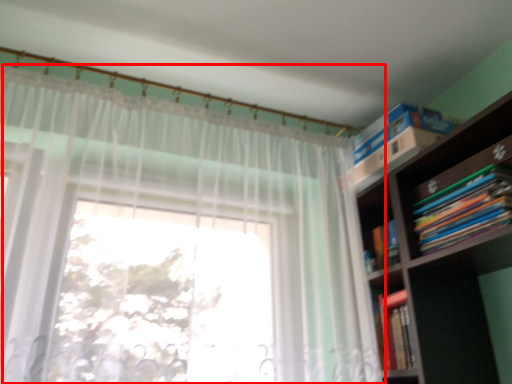
Question: Where is curtain (annotated by the red box) located in relation to book in the image?

Choices:
 (A) left
 (B) right

Answer: (A)